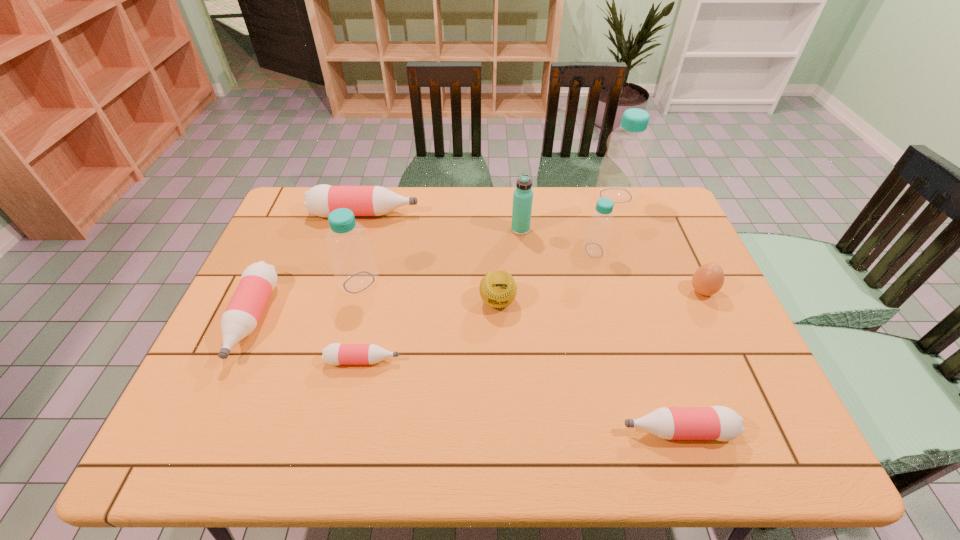
Where is `the tallest object`? This screenshot has height=540, width=960. the tallest object is located at coordinates (622, 170).

Locate an element on the screen. the tallest bottle is located at coordinates (622, 170).

What are the coordinates of `the leftmost blue bottle` in the screenshot? It's located at (353, 263).

This screenshot has height=540, width=960. What are the coordinates of `the second tallest object` in the screenshot? It's located at [x=353, y=263].

The width and height of the screenshot is (960, 540). What are the coordinates of `the sixth object from left to right` in the screenshot? It's located at tap(523, 195).

Identify the location of aqua thermos bottle. This screenshot has height=540, width=960. (523, 195).

Find the location of a particular element. the fifth shortest bottle is located at coordinates (595, 243).

The height and width of the screenshot is (540, 960). Identify the location of the second nearest blue bottle. (595, 243).

In order to click on the biggest pink bottle in this screenshot , I will do (321, 200).

In order to click on the fourth tallest bottle in this screenshot , I will do `click(321, 200)`.